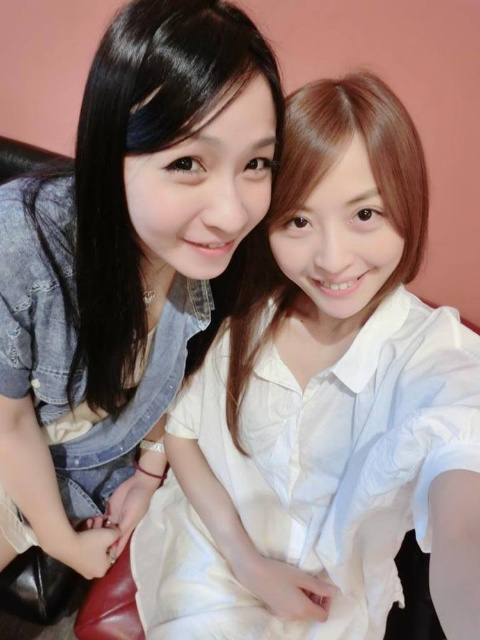
You are a photographer setting up for a portrait session. You notice two shirts displayed at the center of the scene. Which one is bigger between the white cotton shirt at center and the white glossy shirt at center?

The white cotton shirt at center is larger in size than the white glossy shirt at center.

You are trying to take a photo of two friends wearing the white cotton shirt at center and the white glossy shirt at center. Since both shirts are white, how can you tell them apart in the photo?

The white cotton shirt at center is in front of the white glossy shirt at center, so the glossy shirt will appear slightly behind the cotton one in the photo.

Looking at this image, you are taking a photo of two people posing for a selfie. The person on the left is wearing a denim jacket at left. The person on the right is wearing a white, short sleeved blouse. The background is a muted pink color. How far apart are the two people in the photo?

The two people are 21.75 inches apart.